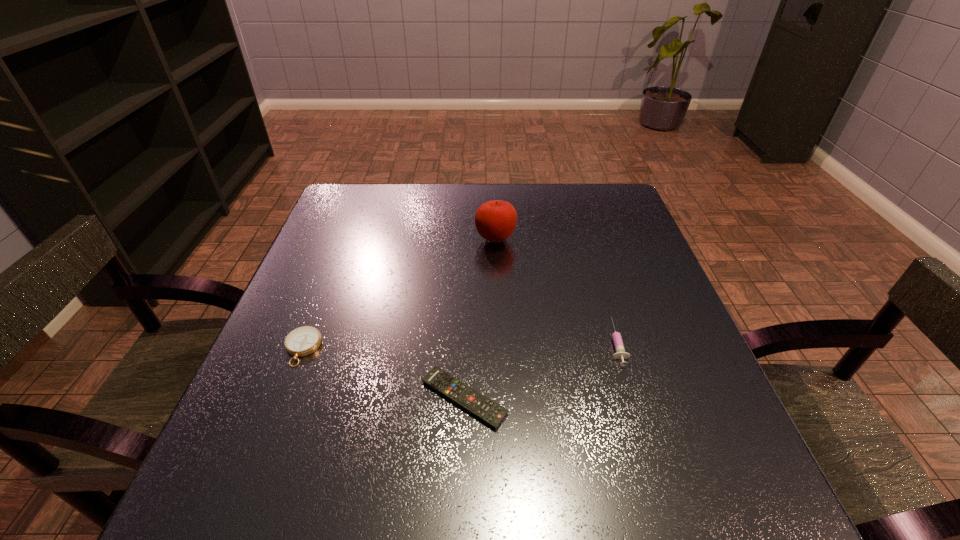
Locate an element on the screen. The height and width of the screenshot is (540, 960). vacant space at the far right corner is located at coordinates (617, 197).

The width and height of the screenshot is (960, 540). I want to click on free space between the nearest object and the tallest object, so click(480, 319).

What are the coordinates of `free area in between the compass and the rightmost object` in the screenshot? It's located at (459, 346).

Locate an element on the screen. Image resolution: width=960 pixels, height=540 pixels. blank region between the third shortest object and the compass is located at coordinates (459, 346).

Locate an element on the screen. free area in between the shortest object and the third shortest object is located at coordinates (540, 370).

Where is `empty space that is in between the tallest object and the remote control`? The height and width of the screenshot is (540, 960). empty space that is in between the tallest object and the remote control is located at coordinates (480, 319).

I want to click on vacant area that lies between the tallest object and the remote control, so click(x=480, y=319).

The width and height of the screenshot is (960, 540). What are the coordinates of `blank region between the third shortest object and the nearest object` in the screenshot? It's located at (540, 370).

I want to click on free area in between the rightmost object and the apple, so click(x=556, y=291).

At what (x,y) coordinates should I click in order to perform the action: click on vacant space in between the tallest object and the shortest object. Please return your answer as a coordinate pair (x, y). Looking at the image, I should click on (480, 319).